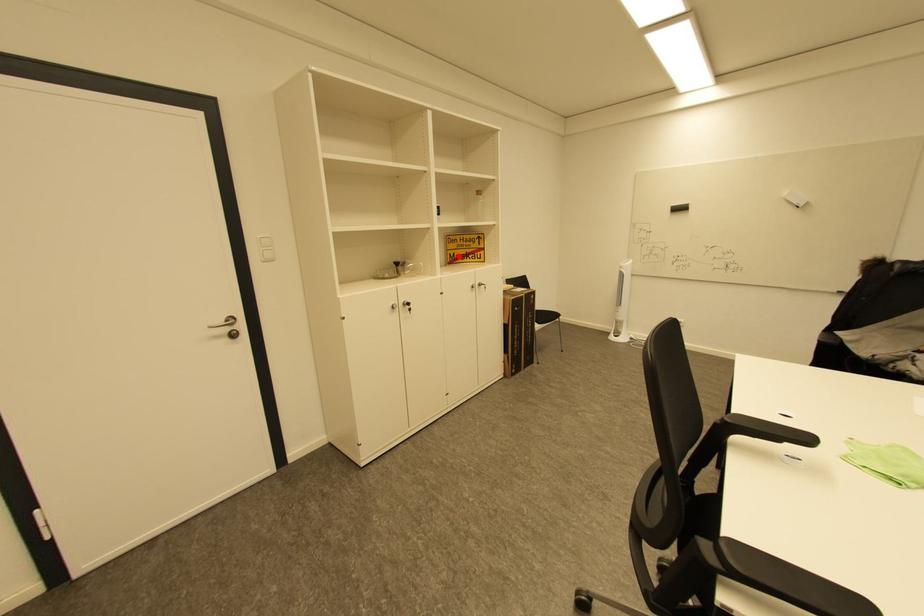
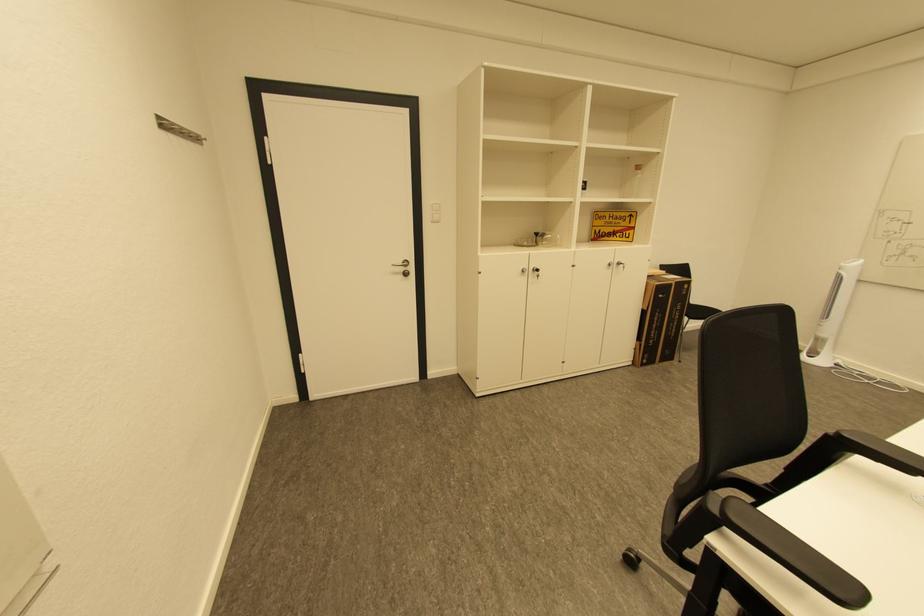
Where in the second image is the point corresponding to the highlighted location from the first image?

(603, 233)